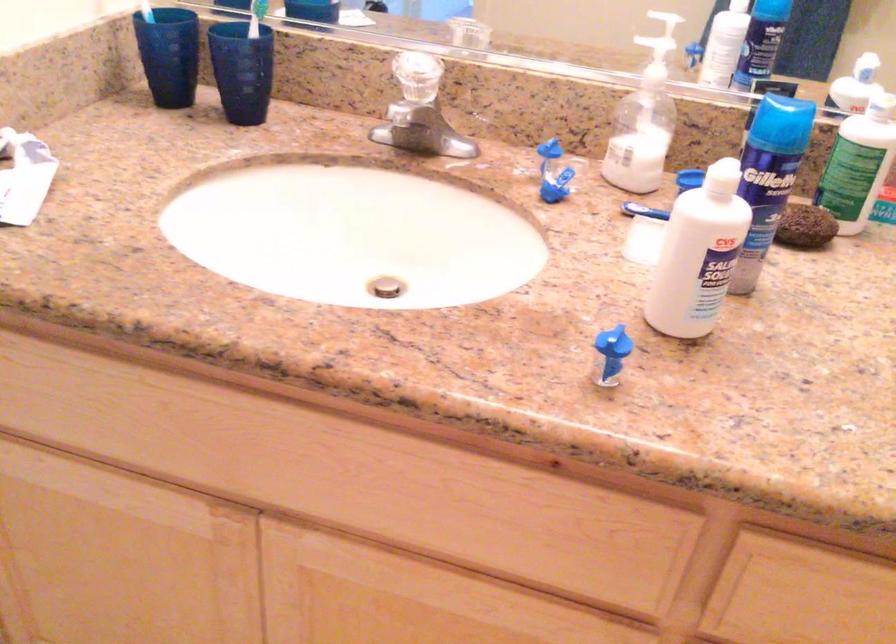
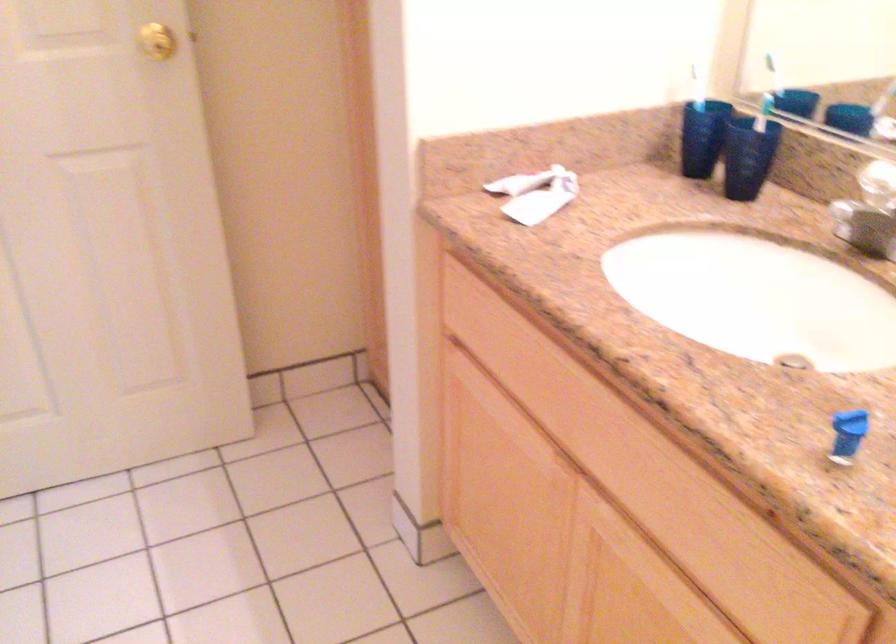
Question: The camera is either moving clockwise (left) or counter-clockwise (right) around the object. The first image is from the beginning of the video and the second image is from the end. Is the camera moving left or right when shooting the video?

Choices:
 (A) Left
 (B) Right

Answer: (B)